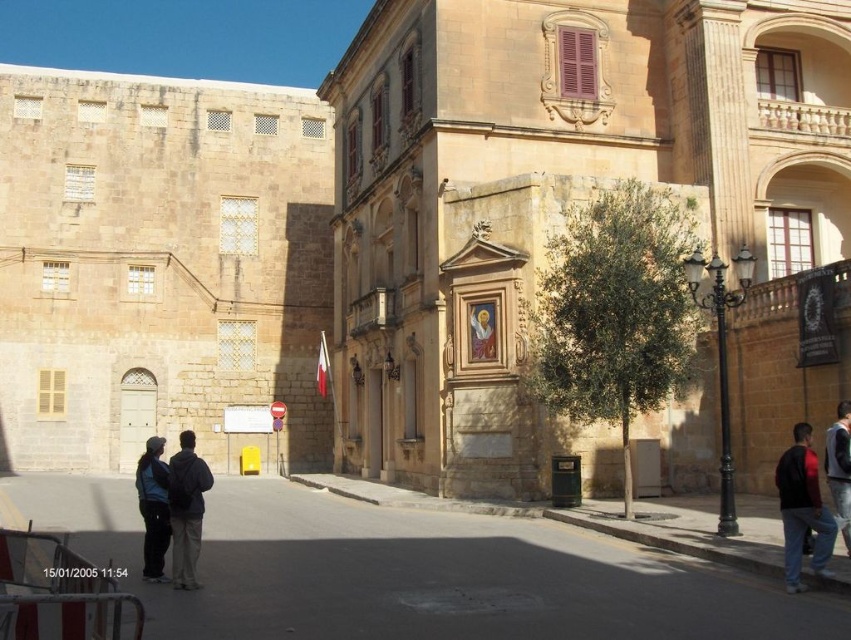
Question: Which point is closer to the camera?

Choices:
 (A) (787, 474)
 (B) (204, 483)
 (C) (161, 449)

Answer: (B)

Question: Is gray concrete pavement at center to the right of dark blue sweater at lower right from the viewer's perspective?

Choices:
 (A) no
 (B) yes

Answer: (A)

Question: Is gray concrete pavement at center in front of dark blue jeans at lower left?

Choices:
 (A) yes
 (B) no

Answer: (A)

Question: Estimate the real-world distances between objects in this image. Which object is closer to the dark gray backpack at center?

Choices:
 (A) dark red jacket at lower right
 (B) gray concrete pavement at center
 (C) dark blue jeans at lower left
 (D) dark blue sweater at lower right

Answer: (C)

Question: Does dark blue jeans at lower left have a smaller size compared to dark blue sweater at lower right?

Choices:
 (A) no
 (B) yes

Answer: (A)

Question: Which of the following is the farthest from the observer?

Choices:
 (A) dark blue jeans at lower left
 (B) dark blue sweater at lower right
 (C) dark gray backpack at center
 (D) dark red jacket at lower right

Answer: (A)